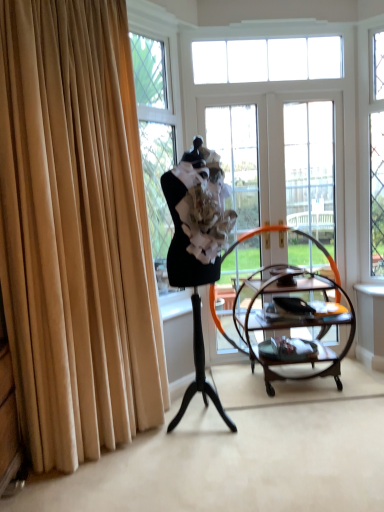
Question: Is clear glass door at center, the second glass door from the left, in front of or behind mahogany wood serving cart at center in the image?

Choices:
 (A) behind
 (B) front

Answer: (A)

Question: Would you say clear glass door at center, arranged as the first glass door when viewed from the right, is inside or outside mahogany wood serving cart at center?

Choices:
 (A) outside
 (B) inside

Answer: (A)

Question: Estimate the real-world distances between objects in this image. Which object is closer to the mahogany wood serving cart at center?

Choices:
 (A) clear glass door at center, the second glass door from the left
 (B) clear glass door at center, which is the second glass door from right to left
 (C) beige velvet curtain at left
 (D) black matte mannequin at center
 (E) clear glass window at upper center

Answer: (B)

Question: Which of these objects is positioned closest to the black matte mannequin at center?

Choices:
 (A) beige velvet curtain at left
 (B) clear glass door at center, acting as the 1th glass door starting from the left
 (C) clear glass window at upper center
 (D) mahogany wood serving cart at center
 (E) clear glass door at center, the second glass door from the left

Answer: (A)